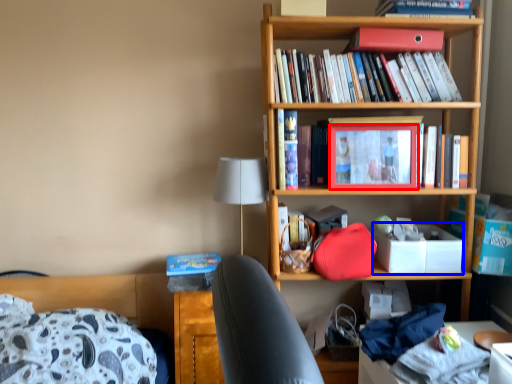
Question: Which object appears closest to the camera in this image, picture frame (highlighted by a red box) or box (highlighted by a blue box)?

Choices:
 (A) picture frame
 (B) box

Answer: (A)